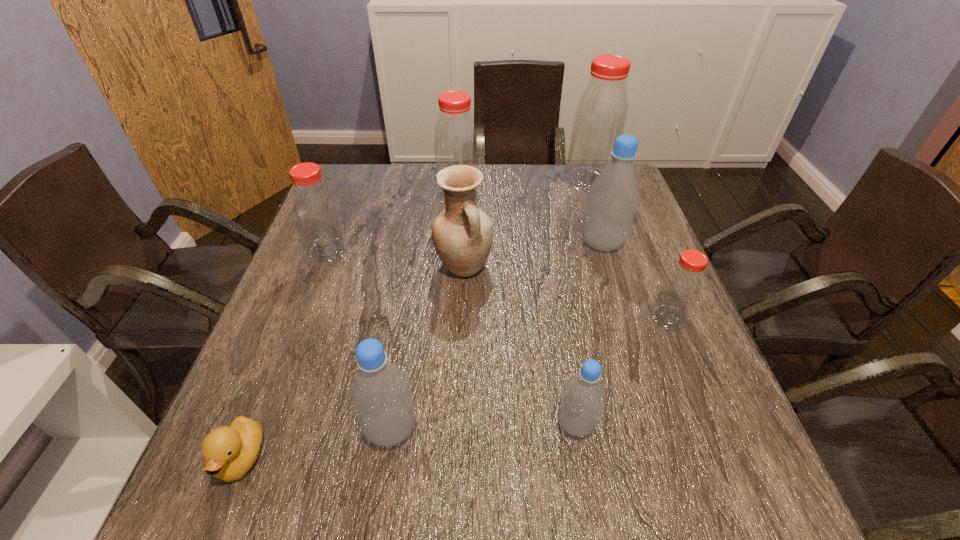
The width and height of the screenshot is (960, 540). Identify the location of free region located 0.050m on the front of the nearest red bottle. (682, 350).

The height and width of the screenshot is (540, 960). Find the location of `vacant space located on the left of the fourth bottle from left to right`. vacant space located on the left of the fourth bottle from left to right is located at coordinates (346, 423).

In order to click on object located in the near edge section of the desktop in this screenshot , I will do `click(230, 452)`.

At what (x,y) coordinates should I click in order to perform the action: click on bottle that is at the left edge. Please return your answer as a coordinate pair (x, y). The image size is (960, 540). Looking at the image, I should click on (316, 211).

You are a GUI agent. You are given a task and a screenshot of the screen. Output one action in this format:
    pyautogui.click(x=<x>, y=<y>)
    Task: Click on the duckling that is at the left edge
    The width and height of the screenshot is (960, 540).
    Given the screenshot: What is the action you would take?
    pyautogui.click(x=230, y=452)

You are a GUI agent. You are given a task and a screenshot of the screen. Output one action in this format:
    pyautogui.click(x=<x>, y=<y>)
    Task: Click on the object that is at the near left corner
    The image size is (960, 540).
    Given the screenshot: What is the action you would take?
    pyautogui.click(x=230, y=452)

This screenshot has width=960, height=540. I want to click on object positioned at the far right corner, so click(601, 114).

Locate an element on the screen. The image size is (960, 540). vacant space at the far edge is located at coordinates (516, 197).

Locate an element on the screen. The height and width of the screenshot is (540, 960). vacant space at the left edge of the desktop is located at coordinates (295, 310).

Where is `free space at the right edge of the desktop`? The width and height of the screenshot is (960, 540). free space at the right edge of the desktop is located at coordinates (636, 254).